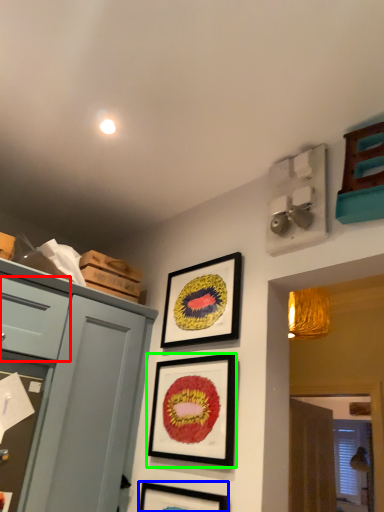
Question: Which object is positioned farthest from drawer (highlighted by a red box)? Select from picture frame (highlighted by a blue box) and picture frame (highlighted by a green box).

Choices:
 (A) picture frame
 (B) picture frame

Answer: (A)